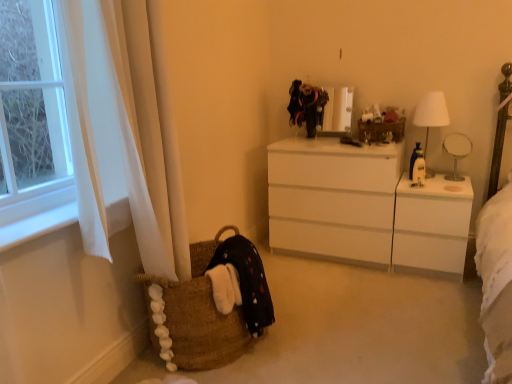
Find the location of a particular element. This screenshot has width=512, height=384. unoccupied region to the right of brown woven basket at lower left is located at coordinates (321, 334).